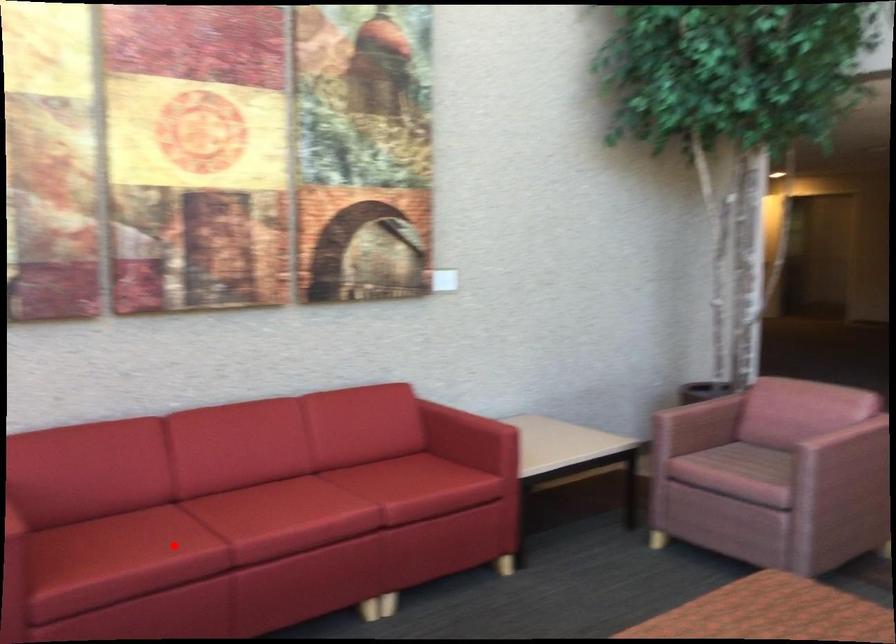
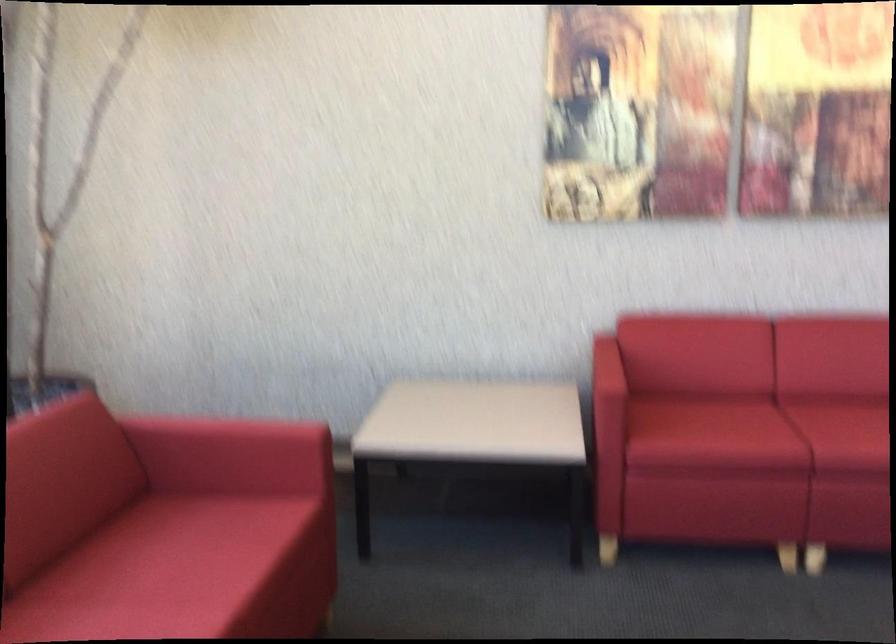
Question: I am providing you with two images of the same scene from different viewpoints. A red point is marked on the first image. Can you still see the location of the red point in image 2?

Choices:
 (A) Yes
 (B) No

Answer: (A)